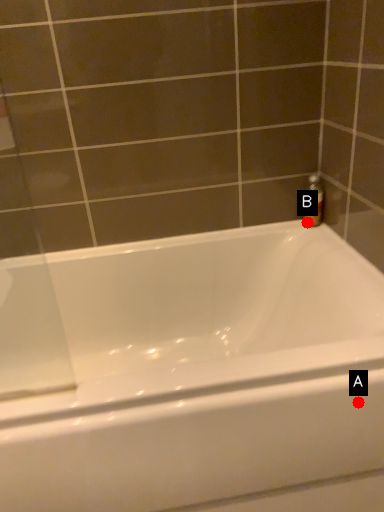
Question: Two points are circled on the image, labeled by A and B beside each circle. Which point appears closest to the camera in this image?

Choices:
 (A) A is closer
 (B) B is closer

Answer: (A)